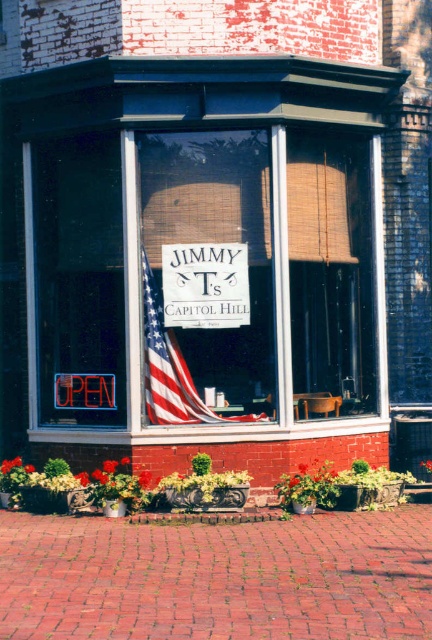
Does white wood sign at center have a smaller size compared to american flag at center?

Yes.

Which is behind, point (240, 244) or point (167, 365)?

The point (167, 365) is behind.

Does point (215, 301) come farther from viewer compared to point (181, 396)?

No, (215, 301) is closer to viewer.

At what (x,y) coordinates should I click in order to perform the action: click on white wood sign at center. Please return your answer as a coordinate pair (x, y). The height and width of the screenshot is (640, 432). Looking at the image, I should click on (205, 285).